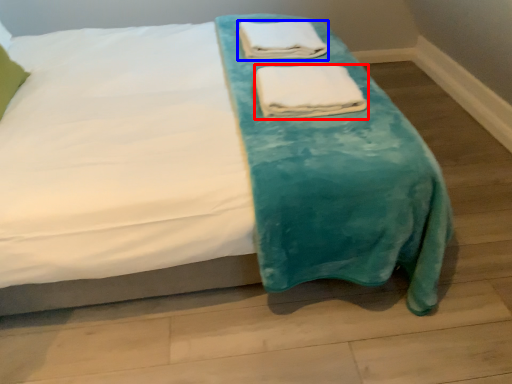
Question: Which object is further to the camera taking this photo, towel (highlighted by a red box) or towel (highlighted by a blue box)?

Choices:
 (A) towel
 (B) towel

Answer: (B)